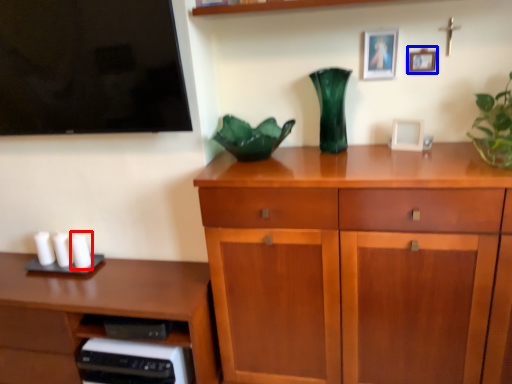
Question: Among these objects, which one is nearest to the camera, candle (highlighted by a red box) or picture frame (highlighted by a blue box)?

Choices:
 (A) candle
 (B) picture frame

Answer: (B)